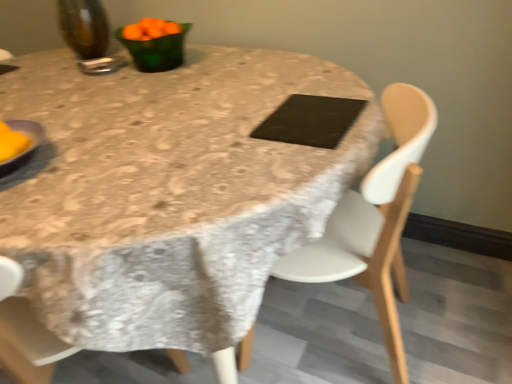
The width and height of the screenshot is (512, 384). In order to click on vacant area that is in front of metallic silver spoon at upper left, the first tableware from the left in this screenshot , I will do `click(95, 80)`.